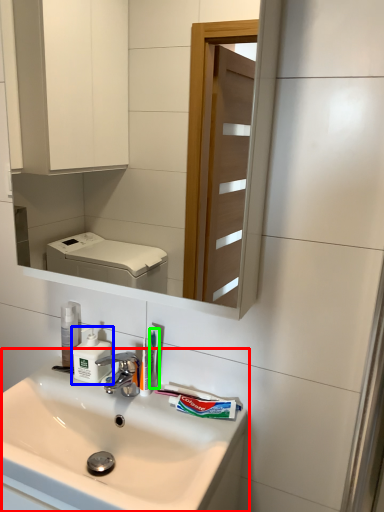
Question: Considering the real-world distances, which object is closest to sink (highlighted by a red box)? soap dispenser (highlighted by a blue box) or toothbrush (highlighted by a green box).

Choices:
 (A) soap dispenser
 (B) toothbrush

Answer: (A)